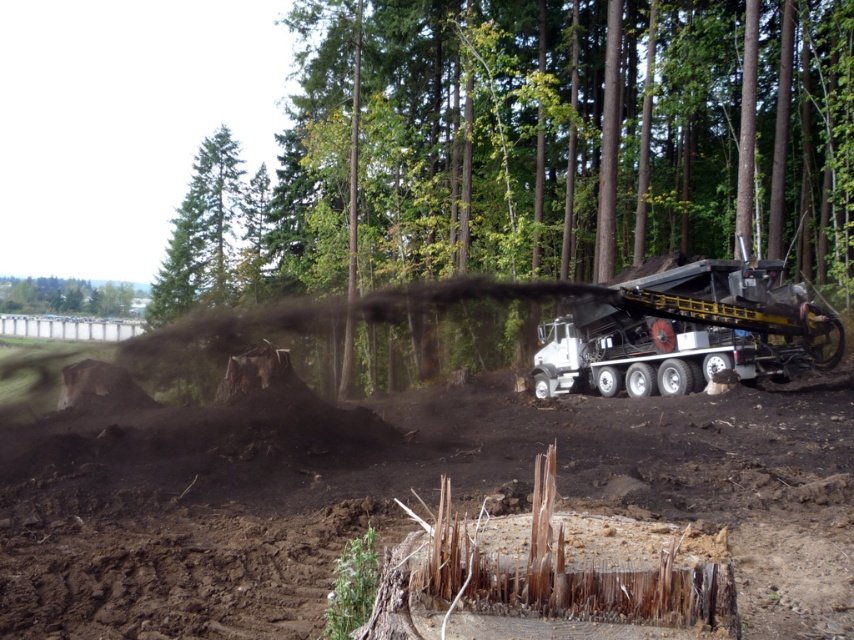
Question: Can you confirm if smooth bark tree stump at center is positioned to the left of metallic gray truck at right?

Choices:
 (A) yes
 (B) no

Answer: (A)

Question: Which object appears closest to the camera in this image?

Choices:
 (A) metallic gray truck at right
 (B) brown soil at center

Answer: (B)

Question: Does metallic gray truck at right appear on the right side of green leafy tree at upper left?

Choices:
 (A) yes
 (B) no

Answer: (A)

Question: Which of the following is the closest to the observer?

Choices:
 (A) brown soil at center
 (B) smooth bark tree stump at center
 (C) metallic gray truck at right
 (D) green leafy tree at upper left

Answer: (A)

Question: Which is farther from the metallic gray truck at right?

Choices:
 (A) green leafy tree at upper left
 (B) smooth bark tree stump at center
 (C) brown soil at center

Answer: (A)

Question: Does brown soil at center appear on the left side of metallic gray truck at right?

Choices:
 (A) yes
 (B) no

Answer: (A)